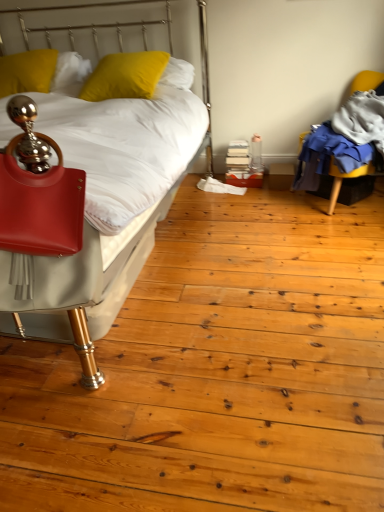
Question: In the image, is yellow fabric chair at right positioned in front of or behind yellow matte pillow at upper left, which is the first pillow in left-to-right order?

Choices:
 (A) behind
 (B) front

Answer: (B)

Question: From a real-world perspective, is yellow fabric chair at right physically located above or below yellow matte pillow at upper left, which is the first pillow in left-to-right order?

Choices:
 (A) above
 (B) below

Answer: (B)

Question: Considering the real-world distances, which object is farthest from the matte red handbag at left?

Choices:
 (A) matte white bed at left
 (B) yellow fabric chair at right
 (C) yellow matte pillow at upper left, positioned as the 1th pillow in right-to-left order
 (D) yellow matte pillow at upper left, arranged as the second pillow when viewed from the right

Answer: (B)

Question: Considering the real-world distances, which object is closest to the yellow fabric chair at right?

Choices:
 (A) matte white bed at left
 (B) matte red handbag at left
 (C) yellow matte pillow at upper left, positioned as the 1th pillow in right-to-left order
 (D) yellow matte pillow at upper left, which is the first pillow in left-to-right order

Answer: (C)